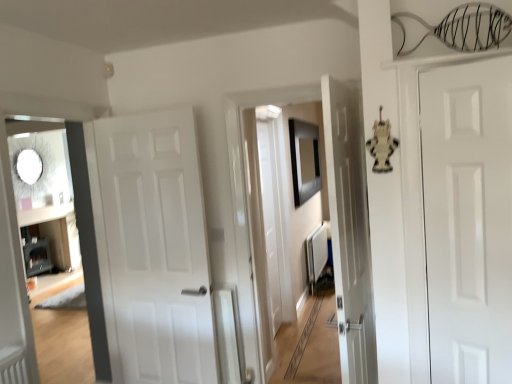
Find the location of `matte white door at left`. matte white door at left is located at coordinates (13, 280).

From the image's perspective, is white matte radiator at center above or below matte white door at left?

white matte radiator at center is below matte white door at left.

In the scene shown: Is matte white door at left surrounded by white matte radiator at center?

Actually, matte white door at left is outside white matte radiator at center.

Which of these two, white matte radiator at center or matte white door at left, stands taller?

matte white door at left.

Between white matte radiator at center and matte white door at left, which one has larger size?

With larger size is matte white door at left.

Is matte white door at left located outside white matte radiator at center?

Indeed, matte white door at left is completely outside white matte radiator at center.

From a real-world perspective, is matte white door at left above or below white matte radiator at center?

matte white door at left is situated higher than white matte radiator at center in the real world.

Which object is further away from the camera, matte white door at left or white matte radiator at center?

white matte radiator at center is further away from the camera.

Is matte white door at left positioned with its back to white matte radiator at center?

matte white door at left does not have its back to white matte radiator at center.

Which is closer, (172, 189) or (298, 122)?

The point (172, 189) is closer to the camera.

Between white matte door at center, which is the 2th door in front-to-back order, and black matte picture frame at center, which one has larger width?

black matte picture frame at center.

Do you think white matte door at center, positioned as the first door in left-to-right order, is within black matte picture frame at center, or outside of it?

white matte door at center, positioned as the first door in left-to-right order, is not enclosed by black matte picture frame at center.

Is the depth of white matte door at center, positioned as the first door in left-to-right order, greater than that of black matte picture frame at center?

That is False.

From the image's perspective, is white glossy door at right, which is the 2th door from left to right, positioned above or below white matte door at center, placed as the first door when sorted from back to front?

Based on their image positions, white glossy door at right, which is the 2th door from left to right, is located above white matte door at center, placed as the first door when sorted from back to front.

How different are the orientations of white glossy door at right, the 1th door from the front, and white matte door at center, which is the second door in right-to-left order, in degrees?

white glossy door at right, the 1th door from the front, and white matte door at center, which is the second door in right-to-left order, are facing 20.9 degrees away from each other.

Is white glossy door at right, the 1th door from the front, in front of white matte door at center, positioned as the first door in left-to-right order?

Yes, white glossy door at right, the 1th door from the front, is closer to the camera.

Between white glossy door at right, which is the 2th door from left to right, and white matte door at center, placed as the first door when sorted from back to front, which one has larger size?

With larger size is white matte door at center, placed as the first door when sorted from back to front.

Which object is thinner, black matte picture frame at center or white matte radiator at center?

black matte picture frame at center.

Based on the photo, is there a large distance between black matte picture frame at center and white matte radiator at center?

No, black matte picture frame at center is not far away from white matte radiator at center.

Between point (294, 126) and point (327, 242), which one is positioned in front?

The point (294, 126) is closer.

Find the location of `door in front of the matte white door at left`. door in front of the matte white door at left is located at coordinates tap(468, 219).

In the scene shown: From a real-world perspective, which is physically below, matte white door at left or white glossy door at right, the 1th door from the front?

matte white door at left.

Is matte white door at left closer to the viewer compared to white glossy door at right, which is counted as the first door, starting from the right?

That is False.

Is matte white door at left aimed at white glossy door at right, which is counted as the first door, starting from the right?

Yes, matte white door at left is turned towards white glossy door at right, which is counted as the first door, starting from the right.

From a real-world perspective, who is located lower, black matte picture frame at center or white matte door at center, which is the 2th door in front-to-back order?

white matte door at center, which is the 2th door in front-to-back order, is physically lower.

How many degrees apart are the facing directions of black matte picture frame at center and white matte door at center, positioned as the first door in left-to-right order?

The angular difference between black matte picture frame at center and white matte door at center, positioned as the first door in left-to-right order, is 103 degrees.

Find the location of `the 2nd door located beneath the black matte picture frame at center (from a real-world perspective)`. the 2nd door located beneath the black matte picture frame at center (from a real-world perspective) is located at coordinates (157, 247).

The height and width of the screenshot is (384, 512). Find the location of `corridor that appears in front of the white matte radiator at center`. corridor that appears in front of the white matte radiator at center is located at coordinates (13, 280).

Where is `radiator behind the matte white door at left`? This screenshot has width=512, height=384. radiator behind the matte white door at left is located at coordinates (316, 254).

Estimate the real-world distances between objects in this image. Which object is further from matte white door at left, white matte radiator at center or white glossy door at right, the 1th door from the front?

white matte radiator at center is further to matte white door at left.

Considering their positions, is black matte picture frame at center positioned closer to matte white door at left than white glossy door at right, which is counted as the first door, starting from the right?

The object closer to matte white door at left is white glossy door at right, which is counted as the first door, starting from the right.

Consider the image. From the image, which object appears to be nearer to white matte door at center, which is the 2th door in front-to-back order, white matte radiator at center or black matte picture frame at center?

Among the two, black matte picture frame at center is located nearer to white matte door at center, which is the 2th door in front-to-back order.

Estimate the real-world distances between objects in this image. Which object is further from matte white door at left, white matte radiator at center or white matte door at center, placed as the first door when sorted from back to front?

Among the two, white matte radiator at center is located further to matte white door at left.

Looking at the image, which one is located closer to black matte picture frame at center, white matte radiator at center or white glossy door at right, which is the 2th door from left to right?

white matte radiator at center lies closer to black matte picture frame at center than the other object.

Looking at the image, which one is located closer to black matte picture frame at center, white glossy door at right, which is the 2th door from left to right, or white matte door at center, which is the second door in right-to-left order?

Based on the image, white matte door at center, which is the second door in right-to-left order, appears to be nearer to black matte picture frame at center.

When comparing their distances from white matte radiator at center, does white glossy door at right, the 1th door from the front, or black matte picture frame at center seem closer?

black matte picture frame at center is positioned closer to the anchor white matte radiator at center.

Which object lies further to the anchor point matte white door at left, white glossy door at right, the 1th door from the front, or black matte picture frame at center?

black matte picture frame at center lies further to matte white door at left than the other object.

At what (x,y) coordinates should I click in order to perform the action: click on door between matte white door at left and white glossy door at right, the 1th door from the front. Please return your answer as a coordinate pair (x, y). Image resolution: width=512 pixels, height=384 pixels. Looking at the image, I should click on (157, 247).

Identify the location of door located between matte white door at left and black matte picture frame at center in the depth direction. This screenshot has width=512, height=384. coord(157,247).

Image resolution: width=512 pixels, height=384 pixels. What are the coordinates of `door between white glossy door at right, which is the 2th door from left to right, and white matte radiator at center in the front-back direction` in the screenshot? It's located at (157, 247).

In order to click on picture frame positioned between white matte door at center, which is the second door in right-to-left order, and white matte radiator at center from near to far in this screenshot , I will do `click(304, 160)`.